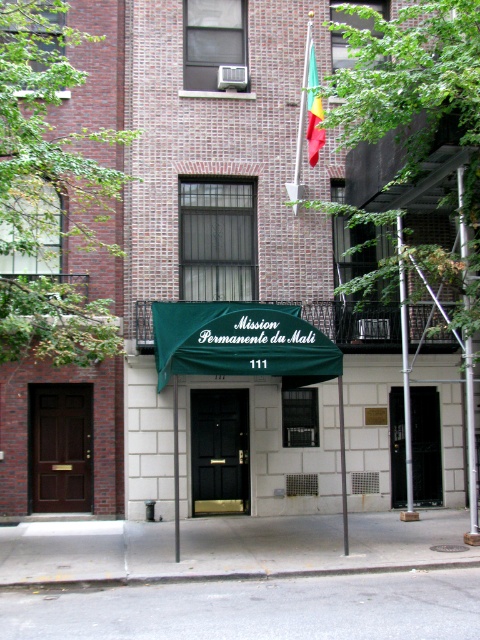
Looking at this image, you are standing in front of the building and want to enter through the entrance. Which object should you approach first, the brown wooden door at left or the green fabric pole at center?

You should approach the brown wooden door at left first because it is located to the left of the green fabric pole at center, making it closer to the entrance.

You are standing in front of the building and want to locate the entrance. Where is the entrance located relative to the point at coordinates (425, 445)?

The entrance is at the black glass door at center, so the point at (425, 445) is on the entrance.

You are a delivery person trying to enter the building through the entrance. The metal scaffolding at center right is blocking your path. Can you still access the black glass door at center? Explain why or why not based on their sizes.

The black glass door at center is larger in size than the metal scaffolding at center right, so the door is bigger than the scaffolding. Since the scaffolding is blocking the path, but the door is larger, it might still be accessible if the scaffolding is positioned in a way that doesn not fully block the door. However, the exact arrangement isn not specified, so we can only confirm the size difference.